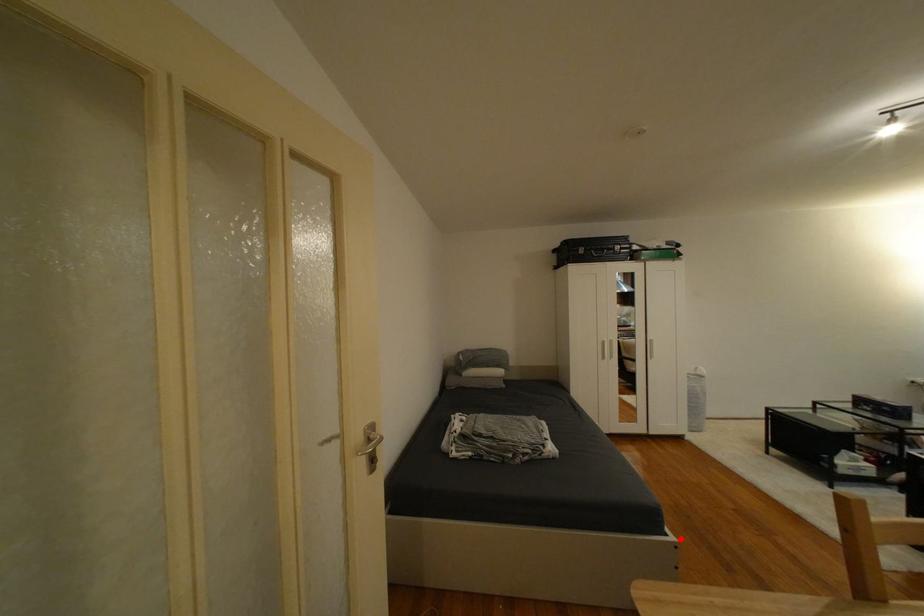
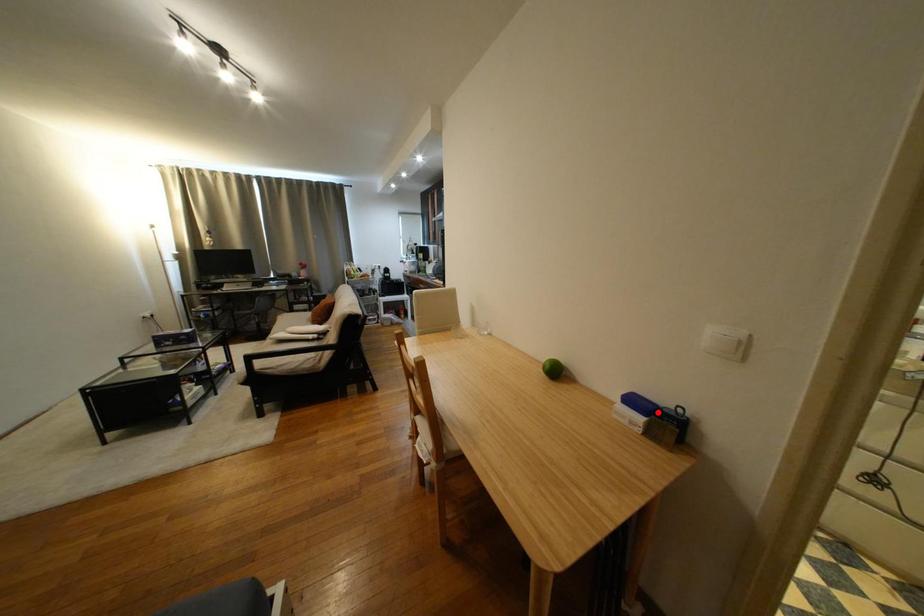
I am providing you with two images of the same scene from different viewpoints. A red point is marked on the first image and another point is marked on the second image. Do the highlighted points in image1 and image2 indicate the same real-world spot?

No